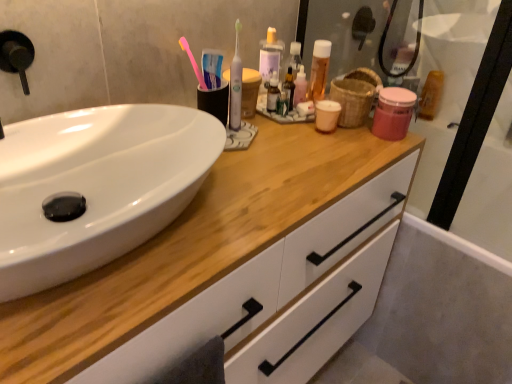
Find the location of a particular element. The height and width of the screenshot is (384, 512). free space on the front side of bamboo basket at upper right is located at coordinates (344, 148).